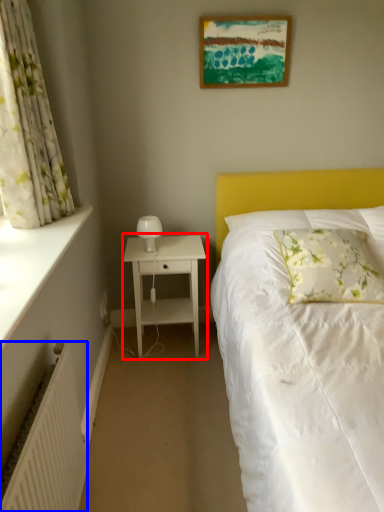
Question: Which point is further to the camera, nightstand (highlighted by a red box) or radiator (highlighted by a blue box)?

Choices:
 (A) nightstand
 (B) radiator

Answer: (A)